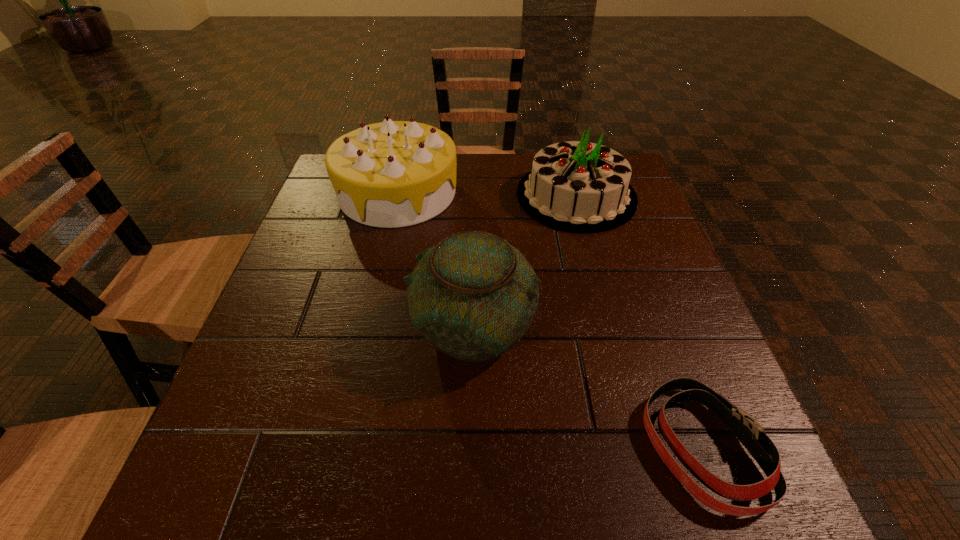
Image resolution: width=960 pixels, height=540 pixels. I want to click on free space between the shortest object and the left birthday cake, so click(x=549, y=320).

Point out which object is positioned as the third nearest to the left birthday cake. Please provide its 2D coordinates. Your answer should be formatted as a tuple, i.e. [(x, y)], where the tuple contains the x and y coordinates of a point satisfying the conditions above.

[(747, 430)]

Select which object is the second closest to the left birthday cake. Please provide its 2D coordinates. Your answer should be formatted as a tuple, i.e. [(x, y)], where the tuple contains the x and y coordinates of a point satisfying the conditions above.

[(473, 296)]

The height and width of the screenshot is (540, 960). Find the location of `free space in the image that satisfies the following two spatial constraints: 1. on the front side of the second nearest object; 2. on the left side of the shortest object`. free space in the image that satisfies the following two spatial constraints: 1. on the front side of the second nearest object; 2. on the left side of the shortest object is located at coordinates (470, 447).

Locate an element on the screen. vacant space that satisfies the following two spatial constraints: 1. on the back side of the right birthday cake; 2. on the right side of the pottery is located at coordinates (474, 196).